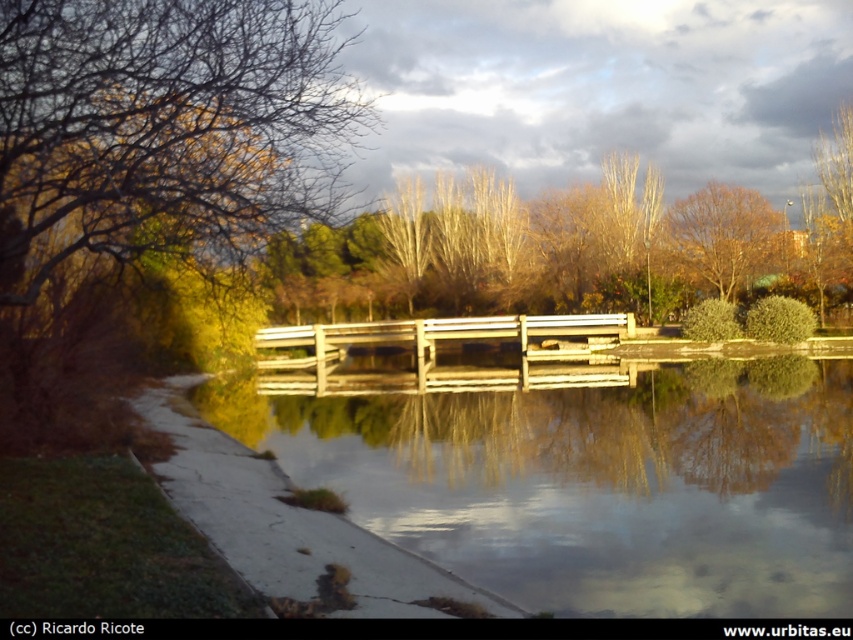
Which is above, transparent water at bridge center or brown matte tree at upper center?

brown matte tree at upper center is above.

Does transparent water at bridge center appear on the right side of brown matte tree at upper center?

No, transparent water at bridge center is not to the right of brown matte tree at upper center.

Who is more forward, [532,593] or [704,244]?

Point [532,593]

Image resolution: width=853 pixels, height=640 pixels. Find the location of `transparent water at bridge center`. transparent water at bridge center is located at coordinates (595, 483).

Which is more to the right, wooden bridge at center or brown matte tree at upper center?

brown matte tree at upper center

Which of these two, wooden bridge at center or brown matte tree at upper center, stands taller?

brown matte tree at upper center is taller.

Who is more forward, [416,364] or [747,208]?

Positioned in front is point [416,364].

Find the location of a particular element. The height and width of the screenshot is (640, 853). wooden bridge at center is located at coordinates (445, 346).

Does transparent water at bridge center appear over wooden bridge at center?

Actually, transparent water at bridge center is below wooden bridge at center.

Which is behind, point (676, 513) or point (318, 380)?

Positioned behind is point (318, 380).

The height and width of the screenshot is (640, 853). Identify the location of transparent water at bridge center. (595, 483).